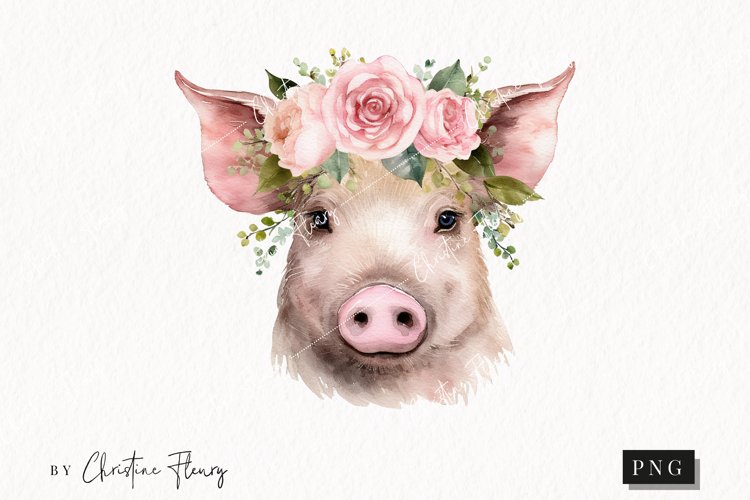
Identify the location of green plant. (500, 214).